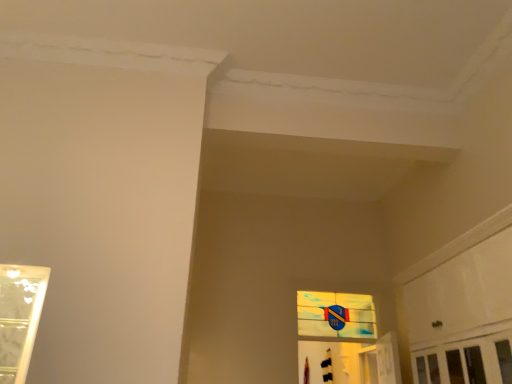
Looking at this image, measure the distance between translucent glass mosaic at center and camera.

translucent glass mosaic at center is 3.88 meters from camera.

The width and height of the screenshot is (512, 384). I want to click on translucent glass mosaic at center, so click(x=336, y=316).

What do you see at coordinates (336, 316) in the screenshot? I see `translucent glass mosaic at center` at bounding box center [336, 316].

Find the location of a particular element. The image size is (512, 384). translucent glass mosaic at center is located at coordinates (336, 316).